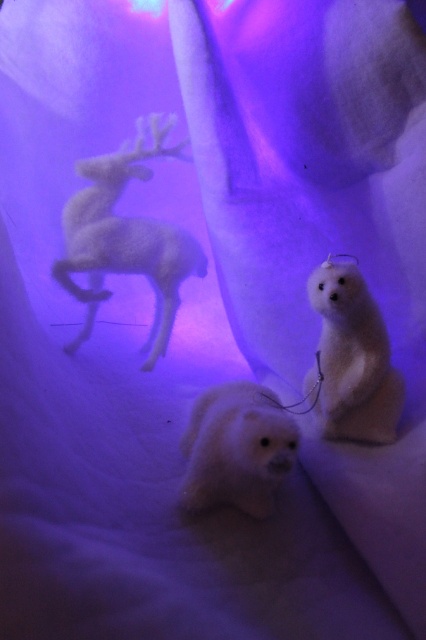
You are a child who wants to reach for the white fluffy polar bear at center and the white plush polar bear at center. Which one is closer to you?

The white fluffy polar bear at center is closer to you since the white plush polar bear at center is positioned behind it.

You are a photographer trying to capture a closeup shot of the two dogs. You can only focus on one point at a time. Which point should you choose to ensure the dogs are in focus? The points are point 1 at point 1 at point (x=339, y=387) and point 2 at point (x=192, y=461). Please explain your reasoning.

You should choose point 1 at point (x=339, y=387) because it is closer to the camera than point 2 at point (x=192, y=461). Since the dogs are seated at these points, focusing on the closer point will ensure they are in focus.

You are a toy collector who wants to place the white fluffy polar bear at center and the white plush polar bear at center on a shelf. The shelf has a space that is 5 inches wide. Can both bears fit side by side without overlapping?

The white fluffy polar bear at center is 5.31 inches away from white plush polar bear at center. Since the distance between them is 5.31 inches, which exceeds the 5 inch shelf space, the two bears cannot fit side by side on the shelf without overlapping.